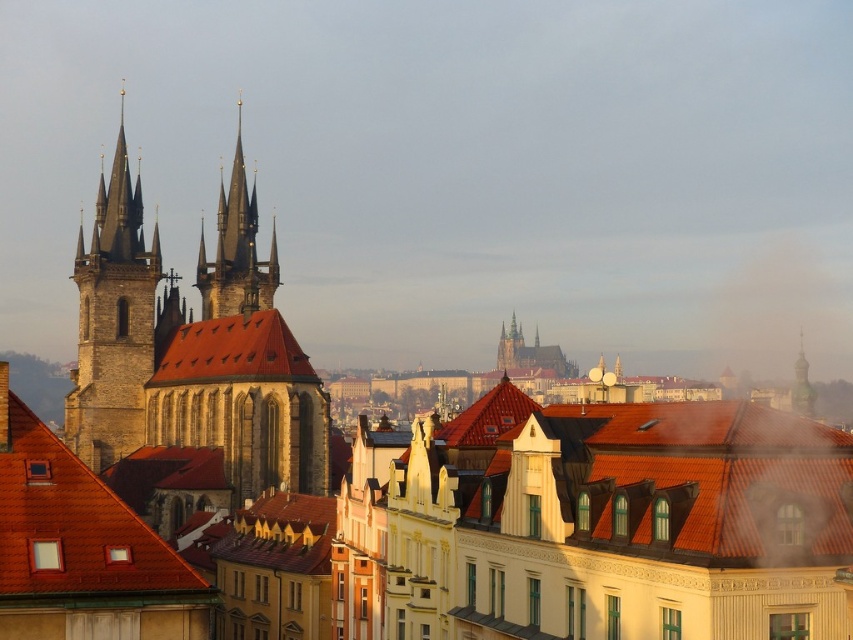
You are a tourist standing in the city square and want to take a photo of both the brown stone church at left and the brown tile roof at center. Based on their positions, which one should you point your camera towards first to include both in the frame?

The brown stone church at left is located below the brown tile roof at center, so you should point your camera towards the brown stone church at left first to ensure both are in the frame.

You are an architect analyzing the cityscape. You need to determine which object occupies more horizontal space in the scene. Based on the provided information, which one is wider between the brown tile roof at lower left and the golden stone spire at center?

The brown tile roof at lower left is wider than the golden stone spire at center according to the description.